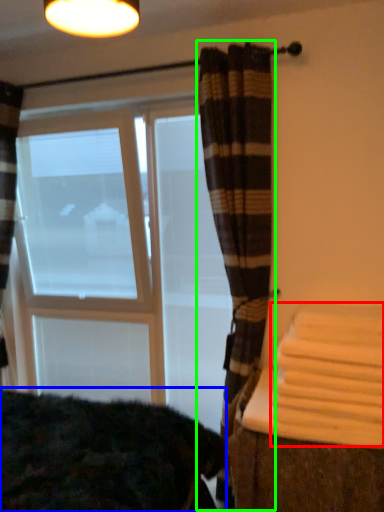
Question: Based on their relative distances, which object is nearer to bath towel (highlighted by a red box)? Choose from bedding (highlighted by a blue box) and curtain (highlighted by a green box).

Choices:
 (A) bedding
 (B) curtain

Answer: (B)